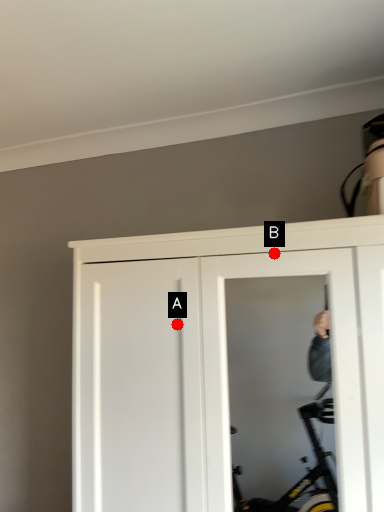
Question: Two points are circled on the image, labeled by A and B beside each circle. Which point is closer to the camera?

Choices:
 (A) A is closer
 (B) B is closer

Answer: (B)